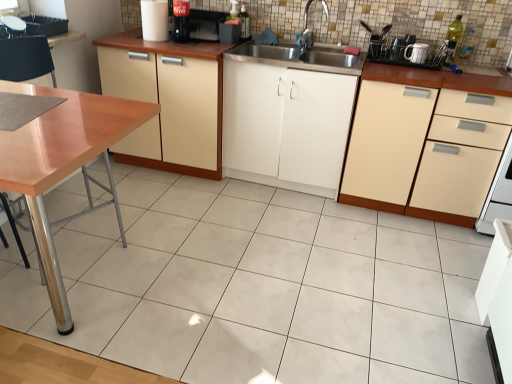
Question: Is wooden table at left shorter than beige matte cabinet at right, the 3th cabinetry positioned from the left?

Choices:
 (A) no
 (B) yes

Answer: (A)

Question: Is wooden table at left at the left side of beige matte cabinet at right, which is the 1th cabinetry from right to left?

Choices:
 (A) yes
 (B) no

Answer: (A)

Question: Does wooden table at left have a greater height compared to beige matte cabinet at right, which is the 1th cabinetry from right to left?

Choices:
 (A) yes
 (B) no

Answer: (A)

Question: Is wooden table at left to the right of beige matte cabinet at right, the 3th cabinetry positioned from the left, from the viewer's perspective?

Choices:
 (A) no
 (B) yes

Answer: (A)

Question: Is wooden table at left closer to camera compared to beige matte cabinet at right, which is the 1th cabinetry from right to left?

Choices:
 (A) yes
 (B) no

Answer: (A)

Question: Considering the positions of point (151, 21) and point (275, 89), is point (151, 21) closer or farther from the camera than point (275, 89)?

Choices:
 (A) farther
 (B) closer

Answer: (A)

Question: In terms of width, does white glossy cup at upper center, which is the 2th appliance in left-to-right order, look wider or thinner when compared to white matte cabinet at center, which is the 2th cabinetry in right-to-left order?

Choices:
 (A) thin
 (B) wide

Answer: (A)

Question: Based on their positions, is white glossy cup at upper center, which is the 2th appliance in left-to-right order, located to the left or right of white matte cabinet at center, which is the 2th cabinetry in right-to-left order?

Choices:
 (A) left
 (B) right

Answer: (A)

Question: Is white glossy cup at upper center, arranged as the third appliance when viewed from the right, bigger or smaller than white matte cabinet at center, which is the 2th cabinetry in right-to-left order?

Choices:
 (A) small
 (B) big

Answer: (A)

Question: From the image's perspective, is white matte cabinet at center, placed as the second cabinetry when sorted from left to right, located above or below white glossy mug at upper right?

Choices:
 (A) above
 (B) below

Answer: (B)

Question: From a real-world perspective, relative to white glossy mug at upper right, is white matte cabinet at center, which is the 2th cabinetry in right-to-left order, vertically above or below?

Choices:
 (A) above
 (B) below

Answer: (B)

Question: Is white matte cabinet at center, which is the 2th cabinetry in right-to-left order, situated inside white glossy mug at upper right or outside?

Choices:
 (A) outside
 (B) inside

Answer: (A)

Question: Is white matte cabinet at center, placed as the second cabinetry when sorted from left to right, taller or shorter than white glossy mug at upper right?

Choices:
 (A) short
 (B) tall

Answer: (B)

Question: Looking at their shapes, would you say wooden table at left is wider or thinner than white glossy mug at upper right?

Choices:
 (A) thin
 (B) wide

Answer: (B)

Question: From the image's perspective, relative to white glossy mug at upper right, is wooden table at left above or below?

Choices:
 (A) above
 (B) below

Answer: (B)